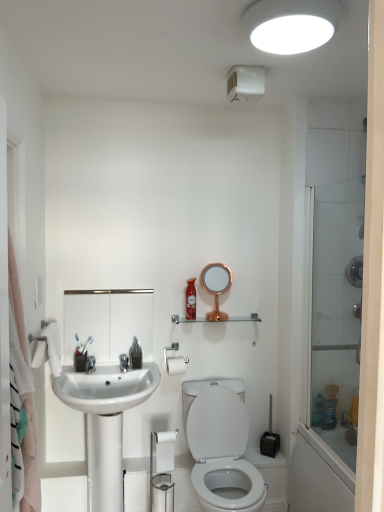
Question: Does white matte toilet paper at lower center, which is the 1th toilet paper from front to back, lie behind transparent glass shower door at right?

Choices:
 (A) no
 (B) yes

Answer: (B)

Question: Is white matte toilet paper at lower center, the 2th toilet paper in the back-to-front sequence, taller than transparent glass shower door at right?

Choices:
 (A) yes
 (B) no

Answer: (B)

Question: Does white matte toilet paper at lower center, which is the 1th toilet paper from front to back, have a smaller size compared to transparent glass shower door at right?

Choices:
 (A) no
 (B) yes

Answer: (B)

Question: From the image's perspective, is white matte toilet paper at lower center, the 1th toilet paper positioned from the bottom, located beneath transparent glass shower door at right?

Choices:
 (A) yes
 (B) no

Answer: (A)

Question: Is transparent glass shower door at right located within white matte toilet paper at lower center, which is the 1th toilet paper from front to back?

Choices:
 (A) no
 (B) yes

Answer: (A)

Question: Considering the relative sizes of white matte toilet paper at lower center, which is the 1th toilet paper from front to back, and transparent glass shower door at right in the image provided, is white matte toilet paper at lower center, which is the 1th toilet paper from front to back, bigger than transparent glass shower door at right?

Choices:
 (A) yes
 (B) no

Answer: (B)

Question: Does white matte toilet paper at lower center, which is the 1th toilet paper from front to back, have a greater height compared to white glossy sink at center?

Choices:
 (A) yes
 (B) no

Answer: (B)

Question: Does white matte toilet paper at lower center, the 2th toilet paper in the back-to-front sequence, have a smaller size compared to white glossy sink at center?

Choices:
 (A) yes
 (B) no

Answer: (A)

Question: From the image's perspective, is white matte toilet paper at lower center, the 2th toilet paper in the back-to-front sequence, beneath white glossy sink at center?

Choices:
 (A) yes
 (B) no

Answer: (B)

Question: From the image's perspective, is white matte toilet paper at lower center, the 1th toilet paper positioned from the bottom, on white glossy sink at center?

Choices:
 (A) yes
 (B) no

Answer: (A)

Question: Are white matte toilet paper at lower center, positioned as the second toilet paper in top-to-bottom order, and white glossy sink at center located far from each other?

Choices:
 (A) no
 (B) yes

Answer: (A)

Question: Is white matte toilet paper at lower center, the 2th toilet paper in the back-to-front sequence, to the right of white glossy sink at center from the viewer's perspective?

Choices:
 (A) yes
 (B) no

Answer: (A)

Question: From a real-world perspective, is white matte toilet paper at lower center, the 2th toilet paper in the back-to-front sequence, located beneath white matte toilet paper at center, the 1th toilet paper when ordered from top to bottom?

Choices:
 (A) no
 (B) yes

Answer: (B)